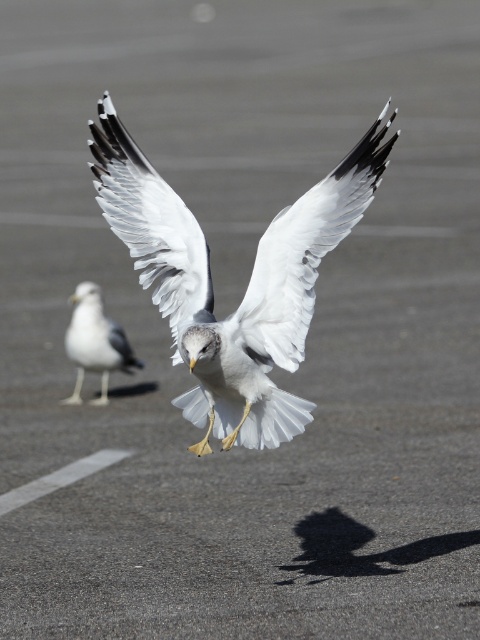
Can you confirm if white feathered bird at center is shorter than white matte wing at center?

No, white feathered bird at center is not shorter than white matte wing at center.

Between point (222, 353) and point (303, 339), which one is positioned in front?

Point (222, 353)

You are a GUI agent. You are given a task and a screenshot of the screen. Output one action in this format:
    pyautogui.click(x=<x>, y=<y>)
    Task: Click on the white feathered bird at center
    This screenshot has width=480, height=640.
    Given the screenshot: What is the action you would take?
    pyautogui.click(x=248, y=284)

This screenshot has width=480, height=640. I want to click on white matte wing at center, so click(x=305, y=252).

Can you confirm if white matte wing at center is positioned to the right of white feathered bird at left?

Indeed, white matte wing at center is positioned on the right side of white feathered bird at left.

Is point (300, 275) closer to viewer compared to point (88, 301)?

Yes, point (300, 275) is in front of point (88, 301).

The width and height of the screenshot is (480, 640). Identify the location of white matte wing at center. (305, 252).

Who is positioned more to the left, white feathered bird at center or white feathered bird at left?

white feathered bird at left

Is point (143, 220) positioned in front of point (91, 360)?

Yes, it is in front of point (91, 360).

Is point (240, 442) positioned before point (92, 355)?

Yes, point (240, 442) is in front of point (92, 355).

Image resolution: width=480 pixels, height=640 pixels. I want to click on white feathered bird at center, so click(248, 284).